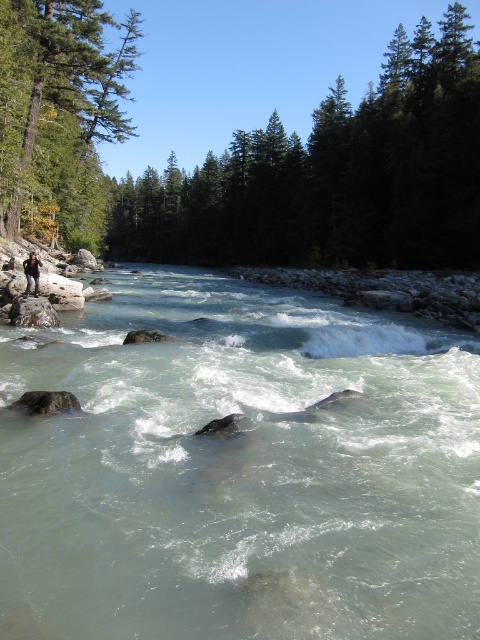
Is point (470, 468) farther from viewer compared to point (25, 268)?

No, (470, 468) is in front of (25, 268).

Looking at this image, who is lower down, clear water at stream left or camouflage fabric backpack at lower left?

Positioned lower is clear water at stream left.

The height and width of the screenshot is (640, 480). Describe the element at coordinates (240, 472) in the screenshot. I see `clear water at stream left` at that location.

At what (x,y) coordinates should I click in order to perform the action: click on clear water at stream left. Please return your answer as a coordinate pair (x, y). This screenshot has width=480, height=640. Looking at the image, I should click on (240, 472).

Which of these two, clear water at stream left or green coniferous trees at upper center, stands taller?

With more height is green coniferous trees at upper center.

Does clear water at stream left appear on the left side of green coniferous trees at upper center?

Correct, you'll find clear water at stream left to the left of green coniferous trees at upper center.

Which is behind, point (297, 292) or point (425, 113)?

The point (425, 113) is behind.

The image size is (480, 640). I want to click on clear water at stream left, so click(240, 472).

Looking at this image, can you confirm if green matte tree at upper left is bigger than camouflage fabric backpack at lower left?

Correct, green matte tree at upper left is larger in size than camouflage fabric backpack at lower left.

Does green matte tree at upper left appear under camouflage fabric backpack at lower left?

Actually, green matte tree at upper left is above camouflage fabric backpack at lower left.

Is point (84, 60) positioned after point (24, 266)?

That is True.

The image size is (480, 640). I want to click on green matte tree at upper left, so point(60,113).